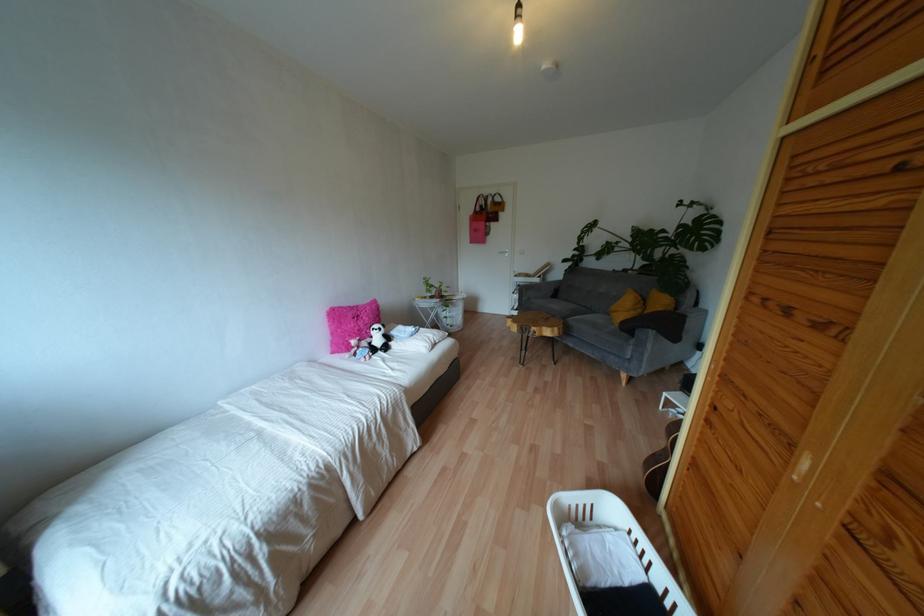
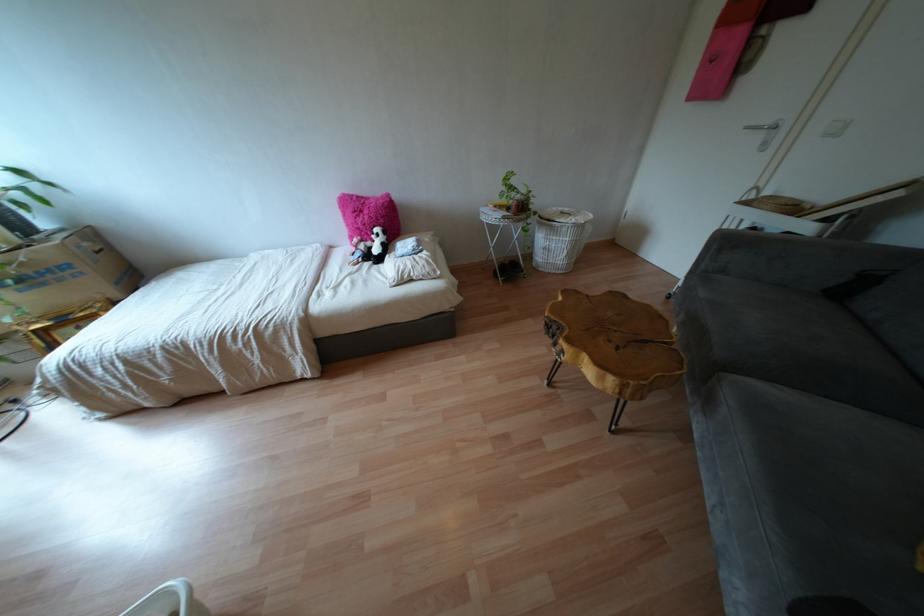
Locate, in the second image, the point that corresponds to pixel 366 318 in the first image.

(365, 217)